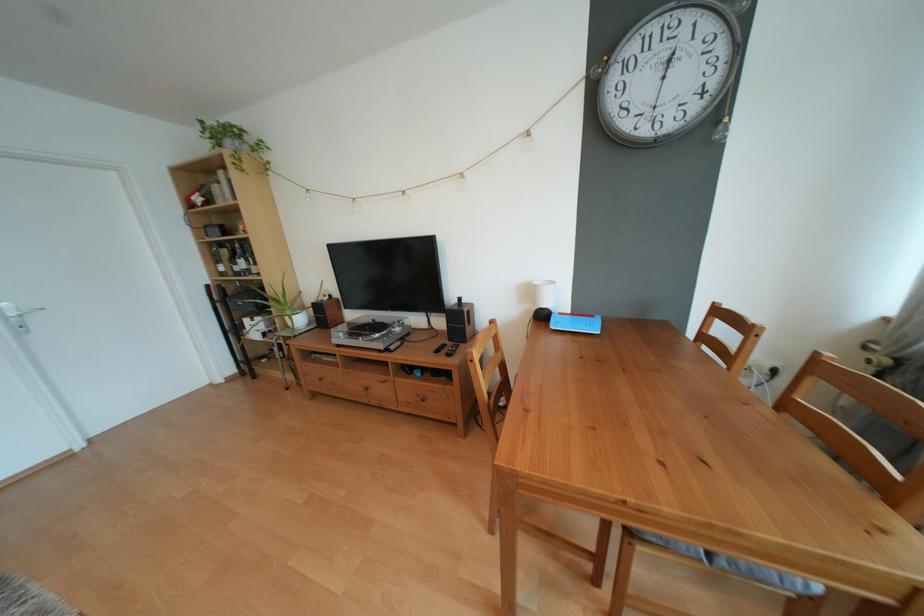
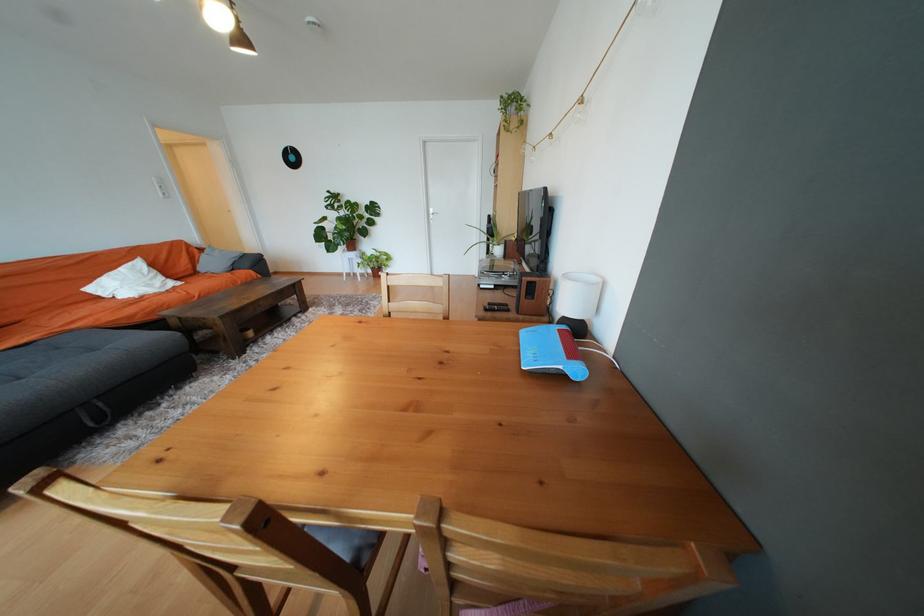
Where in the second image is the point corresponding to point (294, 314) from the first image?

(502, 244)